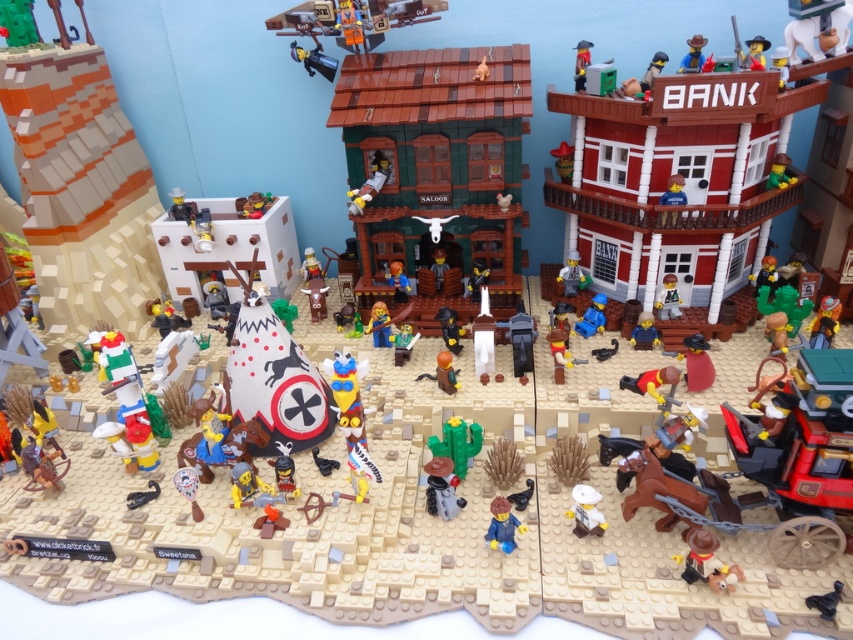
You are a cowboy in the Lego Western town. You see the brick red wagon at lower right and the green matte cactus at center. Which object is positioned higher in the scene?

The brick red wagon at lower right is located above the green matte cactus at center, so it is positioned higher in the scene.

You are a Lego figure standing at the center of the Western town. You need to hide a treasure chest. Which object would be a better choice for hiding it due to its size? The smooth red brick bank at upper right or the brick red wagon at lower right?

The smooth red brick bank at upper right is larger in size than the brick red wagon at lower right, so it would be a better choice for hiding the treasure chest due to its larger capacity.